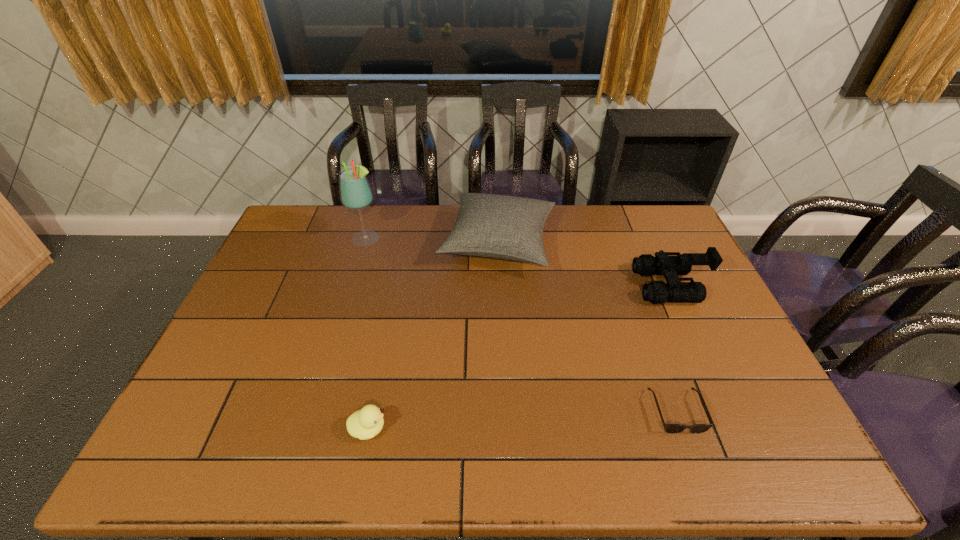
This screenshot has height=540, width=960. I want to click on the leftmost object, so click(355, 192).

At what (x,y) coordinates should I click in order to perform the action: click on alcohol. Please return your answer as a coordinate pair (x, y). The height and width of the screenshot is (540, 960). Looking at the image, I should click on (355, 192).

Locate an element on the screen. Image resolution: width=960 pixels, height=540 pixels. the third object from left to right is located at coordinates (504, 227).

At what (x,y) coordinates should I click in order to perform the action: click on binoculars. Please return your answer as a coordinate pair (x, y). The height and width of the screenshot is (540, 960). Looking at the image, I should click on (674, 291).

This screenshot has height=540, width=960. Identify the location of the fourth object from right to left. (366, 423).

At what (x,y) coordinates should I click in order to perform the action: click on the second shortest object. Please return your answer as a coordinate pair (x, y). This screenshot has height=540, width=960. Looking at the image, I should click on (366, 423).

Locate an element on the screen. The width and height of the screenshot is (960, 540). sunglasses is located at coordinates (669, 428).

Identify the location of vacant space situated on the front of the tallest object. (355, 279).

Locate an element on the screen. The height and width of the screenshot is (540, 960). free space located on the left of the cushion is located at coordinates (389, 243).

This screenshot has width=960, height=540. What are the coordinates of `vacant space located on the front lenses of the binoculars` in the screenshot? It's located at (512, 286).